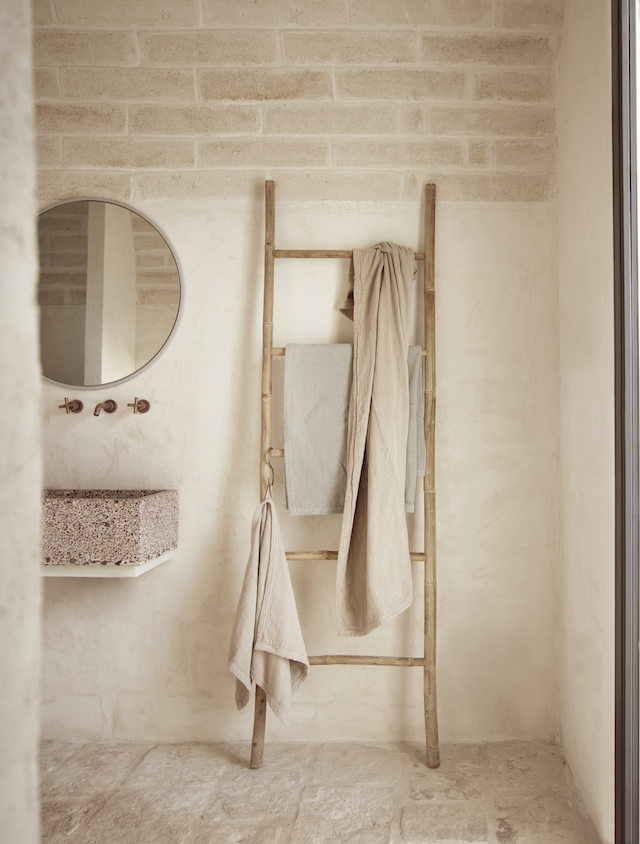
Image resolution: width=640 pixels, height=844 pixels. In order to click on wall in this screenshot , I will do `click(490, 356)`, `click(582, 344)`.